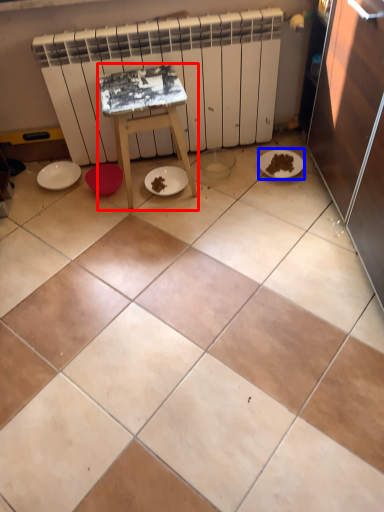
Question: Which object appears farthest to the camera in this image, furniture (highlighted by a red box) or paper plate (highlighted by a blue box)?

Choices:
 (A) furniture
 (B) paper plate

Answer: (B)